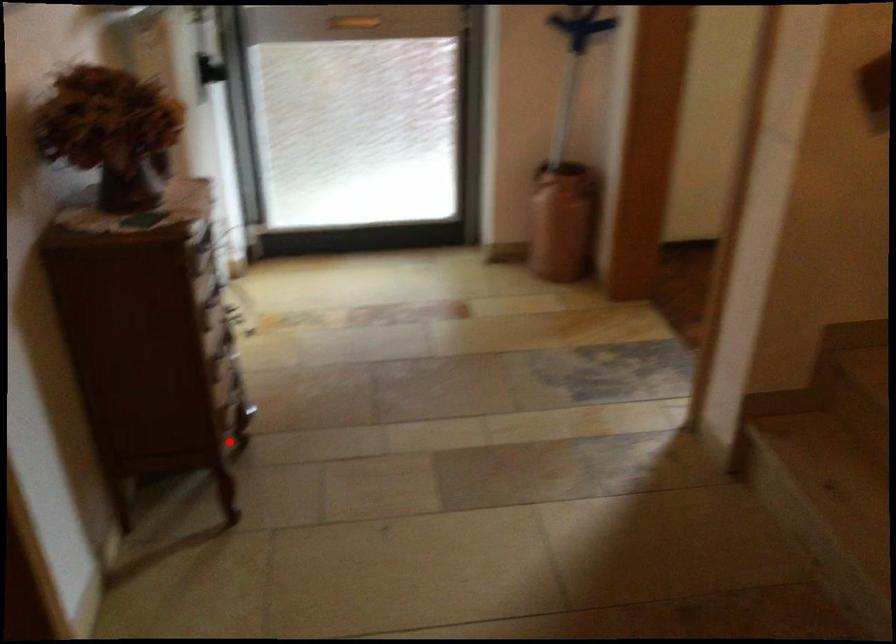
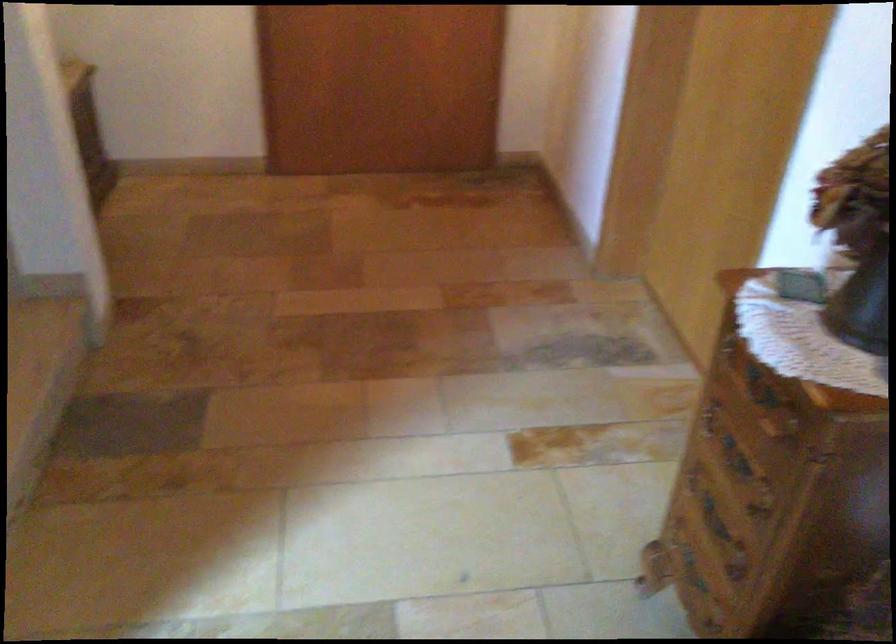
In the second image, find the point that corresponds to the highlighted location in the first image.

(693, 571)